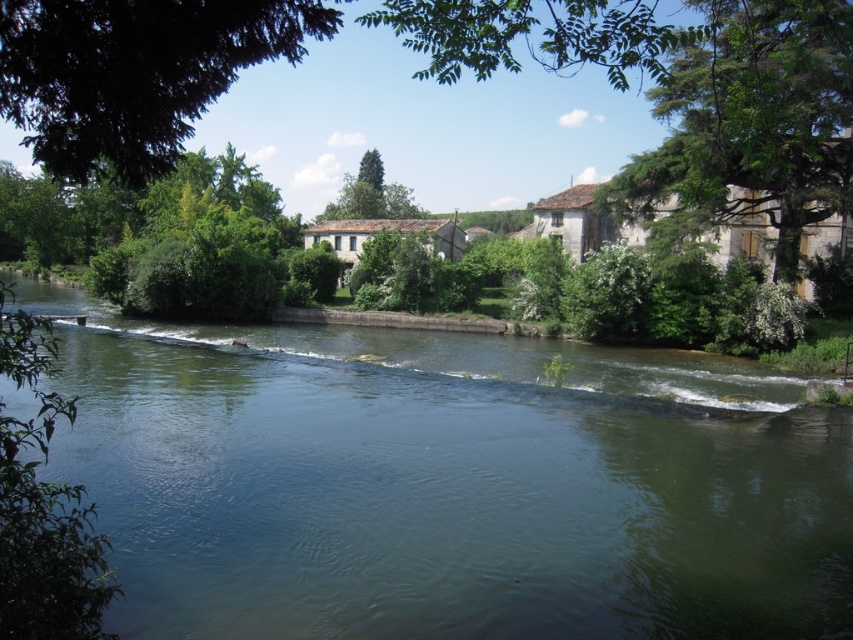
Question: Does green leafy tree at upper right appear on the left side of green leafy tree at upper left?

Choices:
 (A) no
 (B) yes

Answer: (A)

Question: Is green leafy tree at upper right smaller than green leafy tree at upper left?

Choices:
 (A) no
 (B) yes

Answer: (B)

Question: Which object is closer to the camera taking this photo?

Choices:
 (A) green leafy tree at upper right
 (B) green leafy tree at upper left
 (C) green leafy tree at center
 (D) green water at center

Answer: (B)

Question: Is green leafy tree at upper right to the right of green leafy tree at upper left from the viewer's perspective?

Choices:
 (A) yes
 (B) no

Answer: (A)

Question: Which object is positioned closest to the green leafy tree at upper right?

Choices:
 (A) green leafy tree at center
 (B) green leafy tree at upper left
 (C) green water at center

Answer: (C)

Question: Which object is closer to the camera taking this photo?

Choices:
 (A) green leafy tree at center
 (B) green leafy tree at upper left

Answer: (B)